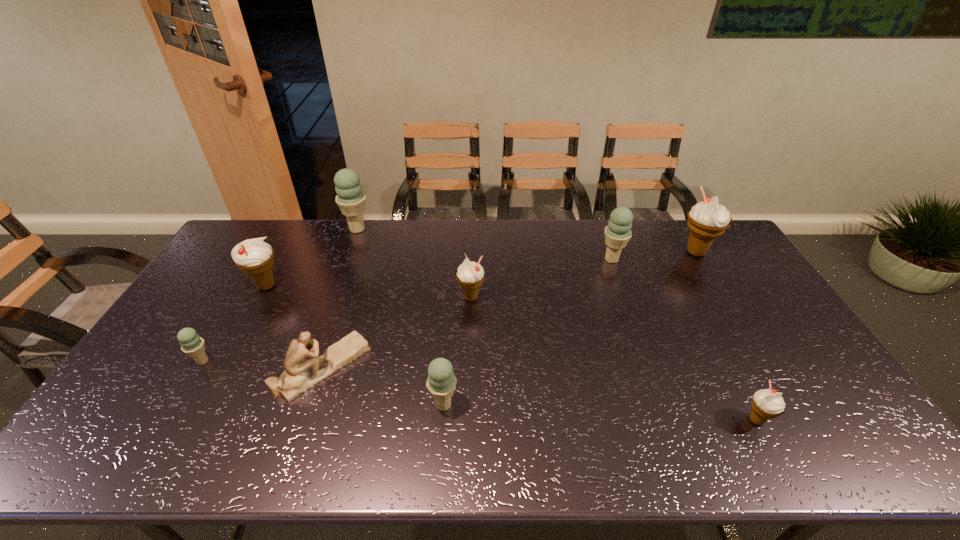
Locate an element on the screen. free space at the far left corner is located at coordinates (243, 238).

Image resolution: width=960 pixels, height=540 pixels. In order to click on vacant region at the near right corner of the desktop in this screenshot , I will do `click(827, 436)`.

Where is `free area in between the second blue ice cream from right to left and the farthest blue ice cream`? The width and height of the screenshot is (960, 540). free area in between the second blue ice cream from right to left and the farthest blue ice cream is located at coordinates (x=400, y=317).

Identify the location of empty space that is in between the third nearest icecream and the second white icecream from left to right. (337, 329).

The image size is (960, 540). I want to click on vacant space that is in between the biggest blue ice cream and the second smallest blue ice cream, so click(400, 317).

Where is `free area in between the biggest white icecream and the nearest white icecream`? Image resolution: width=960 pixels, height=540 pixels. free area in between the biggest white icecream and the nearest white icecream is located at coordinates (726, 336).

Where is `empty space that is in between the third biggest blue ice cream and the second biggest blue ice cream`? empty space that is in between the third biggest blue ice cream and the second biggest blue ice cream is located at coordinates (528, 332).

Where is `vacant region between the biggest white icecream and the nearest white icecream`? The width and height of the screenshot is (960, 540). vacant region between the biggest white icecream and the nearest white icecream is located at coordinates (726, 336).

Find the location of `free area in between the second smallest blue ice cream and the sixth icecream from right to left`. free area in between the second smallest blue ice cream and the sixth icecream from right to left is located at coordinates (400, 317).

Identify the location of vacant space that is in between the farthest white icecream and the second nearest blue ice cream. The height and width of the screenshot is (540, 960). (449, 307).